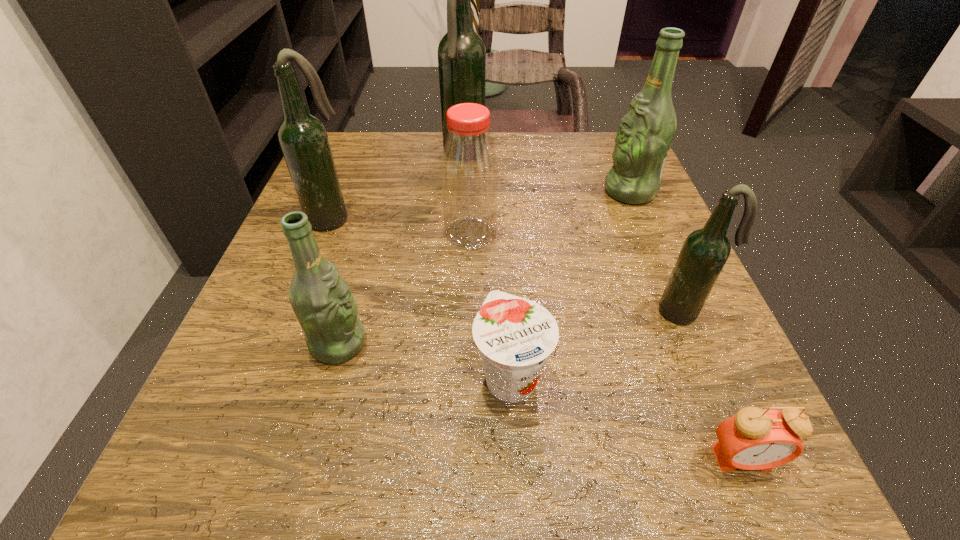
In order to click on the biggest dark beer bottle in this screenshot , I will do `click(461, 52)`.

Locate an element on the screen. the second dark beer bottle from right to left is located at coordinates (461, 52).

I want to click on the farther green beer bottle, so click(x=646, y=132).

This screenshot has width=960, height=540. I want to click on the right green beer bottle, so click(x=646, y=132).

You are a GUI agent. You are given a task and a screenshot of the screen. Output one action in this format:
    pyautogui.click(x=<x>, y=<y>)
    Task: Click on the leftmost beer bottle
    
    Given the screenshot: What is the action you would take?
    pyautogui.click(x=303, y=139)

Image resolution: width=960 pixels, height=540 pixels. What are the coordinates of `the second nearest dark beer bottle` in the screenshot? It's located at (303, 139).

Identify the location of bottle. This screenshot has height=540, width=960. (469, 166).

Image resolution: width=960 pixels, height=540 pixels. What are the coordinates of `the nearest dark beer bottle` in the screenshot? It's located at (705, 251).

At what (x,y) coordinates should I click in order to perform the action: click on the smallest dark beer bottle. Please return your answer as a coordinate pair (x, y). The height and width of the screenshot is (540, 960). Looking at the image, I should click on (705, 251).

Where is `the smaller green beer bottle`? the smaller green beer bottle is located at coordinates (322, 301).